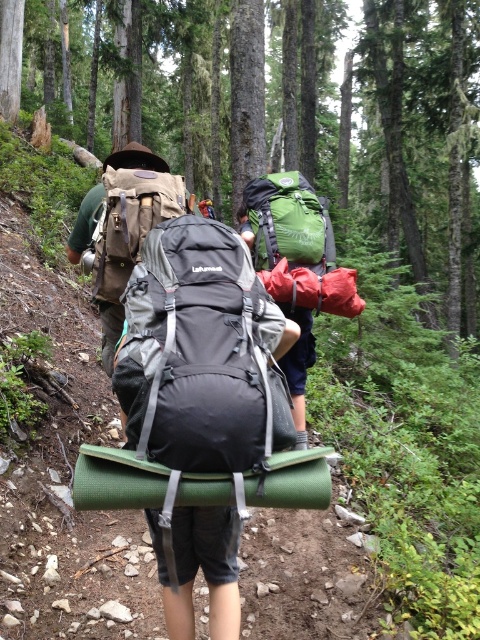
Does green fabric backpack at center appear on the left side of matte brown backpack at center?

Incorrect, green fabric backpack at center is not on the left side of matte brown backpack at center.

Locate an element on the screen. Image resolution: width=480 pixels, height=640 pixels. green fabric backpack at center is located at coordinates (298, 244).

Between black matte backpack at center and matte brown backpack at center, which one appears on the right side from the viewer's perspective?

From the viewer's perspective, black matte backpack at center appears more on the right side.

Where is `black matte backpack at center`? black matte backpack at center is located at coordinates (194, 349).

Who is more forward, (252, 412) or (290, 292)?

Point (252, 412)

Does black matte backpack at center come in front of green fabric backpack at center?

Yes, black matte backpack at center is in front of green fabric backpack at center.

Measure the distance between point (175, 464) and camera.

1.70 meters

You are a GUI agent. You are given a task and a screenshot of the screen. Output one action in this format:
    pyautogui.click(x=<x>, y=<y>)
    Task: Click on the black matte backpack at center
    The height and width of the screenshot is (640, 480).
    Given the screenshot: What is the action you would take?
    pyautogui.click(x=194, y=349)